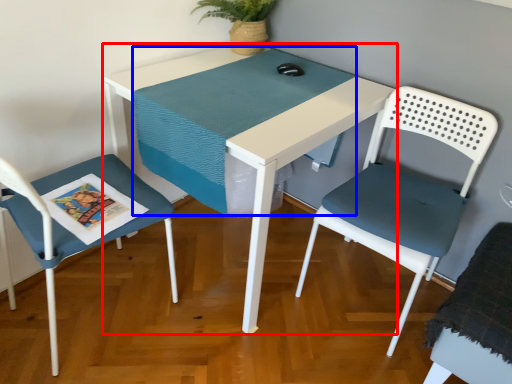
Question: Which object appears closest to the camera in this image, table (highlighted by a red box) or table top (highlighted by a blue box)?

Choices:
 (A) table
 (B) table top

Answer: (A)